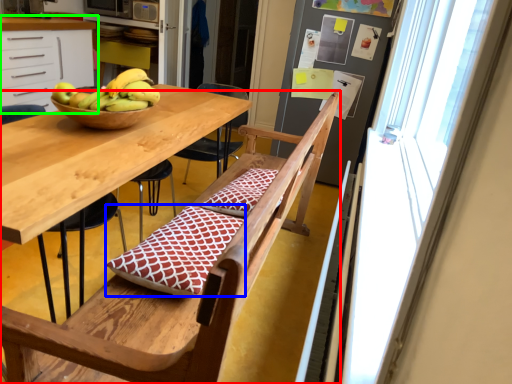
Question: Which object is the closest to the chair (highlighted by a red box)? Choose among these: quilt (highlighted by a blue box) or cabinetry (highlighted by a green box).

Choices:
 (A) quilt
 (B) cabinetry

Answer: (A)